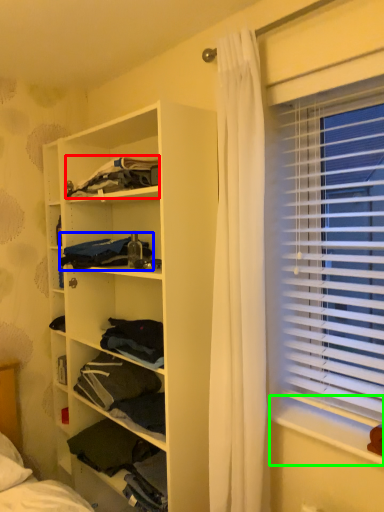
Question: Which is farther away from clothing (highlighted by a red box)? clothing (highlighted by a blue box) or window sill (highlighted by a green box)?

Choices:
 (A) clothing
 (B) window sill

Answer: (B)